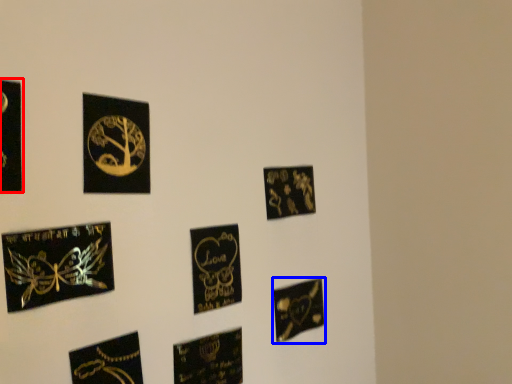
Question: Which point is further to the camera, picture frame (highlighted by a red box) or picture frame (highlighted by a blue box)?

Choices:
 (A) picture frame
 (B) picture frame

Answer: (B)